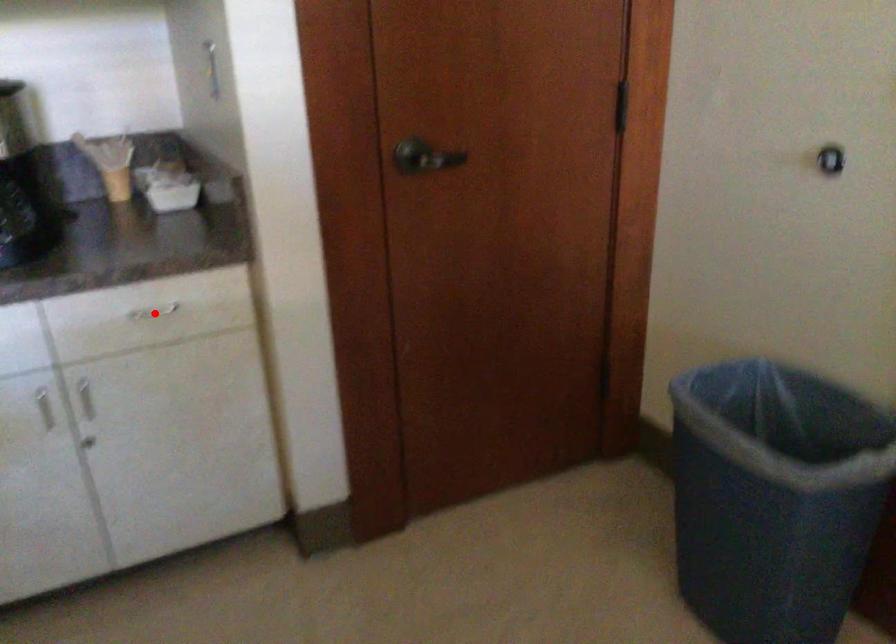
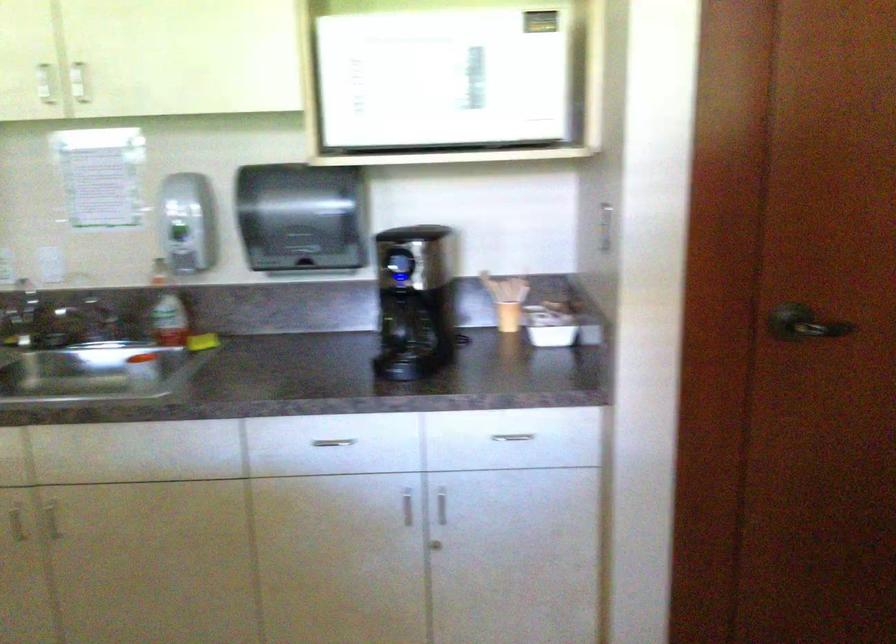
Find the pixel in the second image that matches the highlighted location in the first image.

(512, 437)